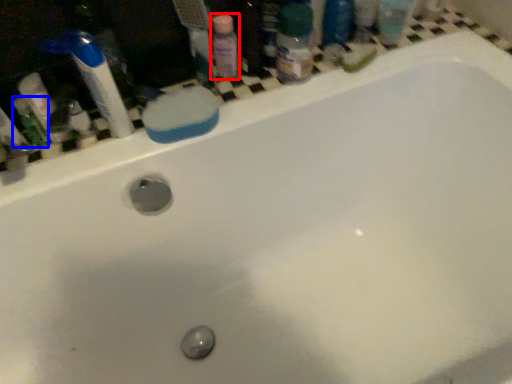
Question: Among these objects, which one is nearest to the camera, cleaning product (highlighted by a red box) or mouthwash (highlighted by a blue box)?

Choices:
 (A) cleaning product
 (B) mouthwash

Answer: (B)